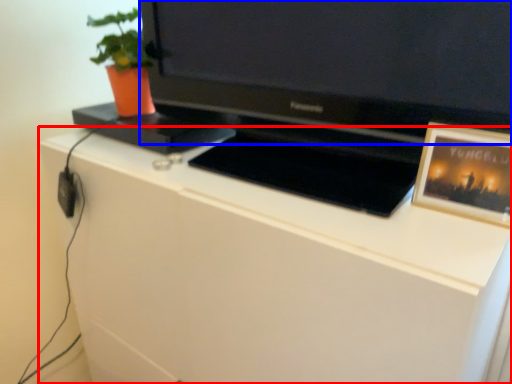
Question: Which object appears closest to the camera in this image, cabinetry (highlighted by a red box) or television (highlighted by a blue box)?

Choices:
 (A) cabinetry
 (B) television

Answer: (B)